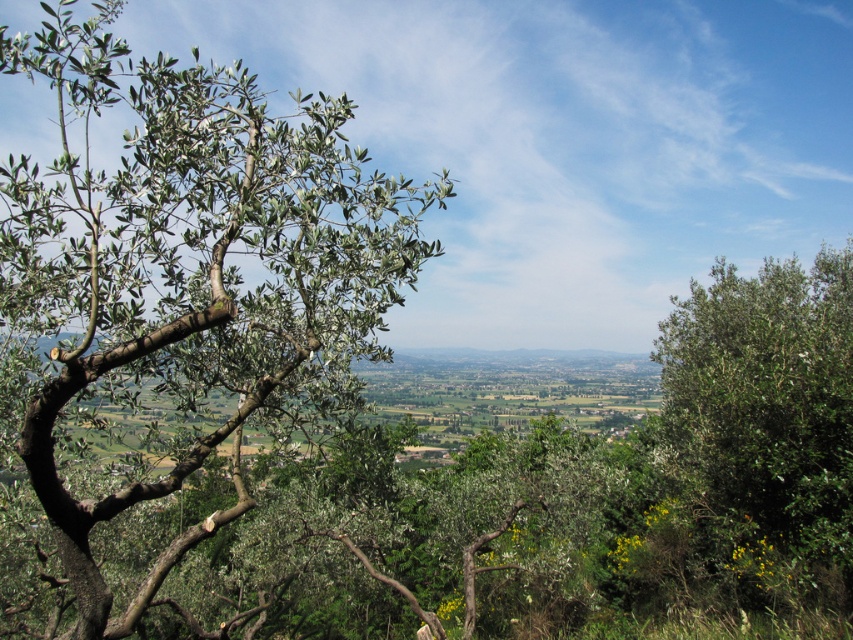
You are standing in the middle of the olive grove and see the green leafy tree at left and the green leafy tree at right. Which tree is closer to your left side?

The green leafy tree at left is closer to your left side because it is positioned on the left side of the green leafy tree at right.

You are standing in the foreground of the olive trees and want to walk to the first point you see between the two points, point (x=126, y=232) and point (x=691, y=291). Which point should you head towards?

You should head towards point (x=126, y=232) because it is closer to you than point (x=691, y=291).